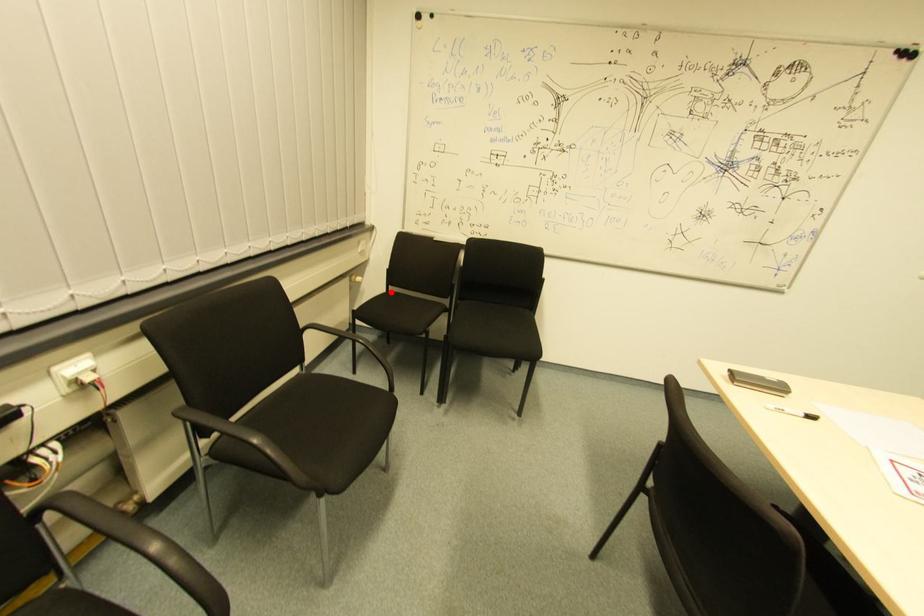
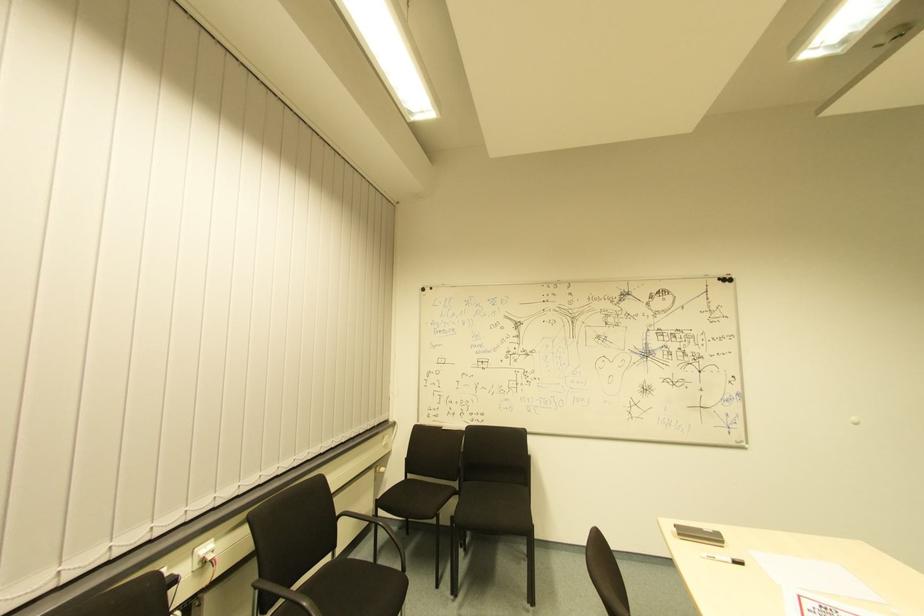
Question: I am providing you with two images of the same scene from different viewpoints. A red point is shown in image1. For the corresponding object point in image2, is it positioned nearer or farther from the camera?

Choices:
 (A) Nearer
 (B) Farther

Answer: (B)